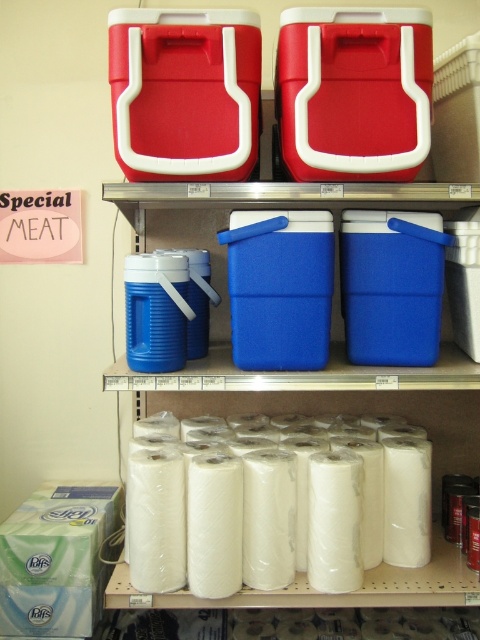
You are a store employee who needs to restock items. You have a new package that is 30 centimeters wide. There is a space between the white matte toilet paper at lower center and the blue plastic cooler at center. Can the new package fit in that space?

The distance between the white matte toilet paper at lower center and the blue plastic cooler at center is 33.63 centimeters. Since the package is 30 centimeters wide, it can fit in the space between them.

In the scene shown: You are organizing a store shelf and need to place a new item that is 12 inches wide. You have space on the shelf where the white matte toilet paper at lower center and the blue plastic cooler at center are located. Which item can the new item fit next to based on their widths?

The white matte toilet paper at lower center has a smaller width than the blue plastic cooler at center. Since the new item is 12 inches wide, it can fit next to the white matte toilet paper at lower center if there is enough space, but it might not fit next to the blue plastic cooler at center if the cooler is wider than 12 inches. However, without knowing the exact widths, we can only confirm that the white matte toilet paper is narrower than the cooler.

Looking at this image, you are a customer in a store looking at the shelving unit. You need to place an item on the bottom shelf, which is currently occupied by the white matte toilet paper at lower center and the blue plastic cooler at center. Which item can you stack another item on top of without exceeding the height limit?

The white matte toilet paper at lower center is not as tall as the blue plastic cooler at center, so you can stack another item on top of the blue plastic cooler at center since it is taller and provides more vertical space.